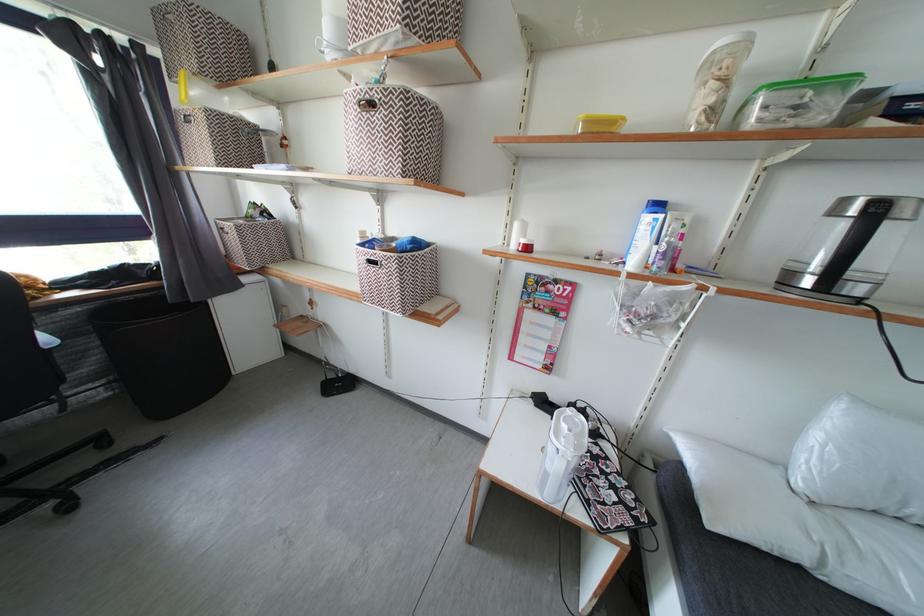
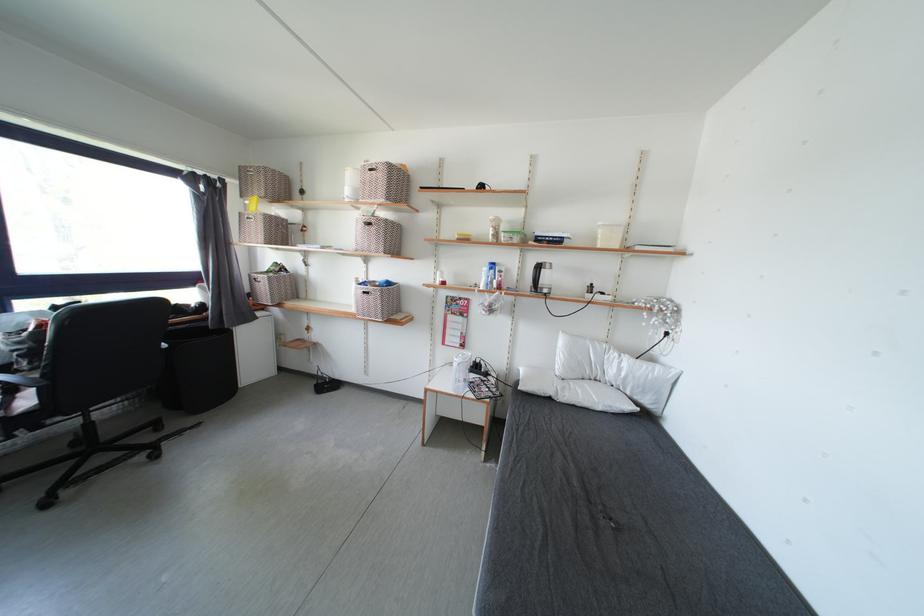
Question: I am providing you with two images of the same scene from different viewpoints. Which of the following objects are not visible in image2?

Choices:
 (A) sofa sitting surface
 (B) black trash bin
 (C) white spray bottle
 (D) none of these

Answer: (D)